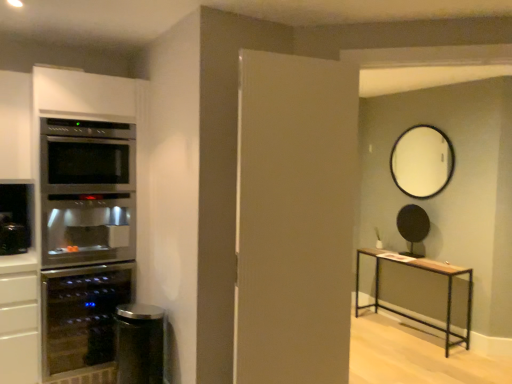
Describe the element at coordinates (426, 270) in the screenshot. This screenshot has width=512, height=384. I see `light brown wood table at right` at that location.

Identify the location of light brown wood table at right. This screenshot has height=384, width=512. (426, 270).

Locate an element on the screen. The image size is (512, 384). satin black trash can at lower left, arranged as the 2th appliance when viewed from the left is located at coordinates [139, 344].

The height and width of the screenshot is (384, 512). Identify the location of stainless steel fridge at left. (85, 238).

The image size is (512, 384). What do you see at coordinates (422, 161) in the screenshot?
I see `white glossy mirror at upper center` at bounding box center [422, 161].

Find the location of a particular element. matte glass wine cooler at left, the second appliance from the front is located at coordinates (82, 316).

At what (x,y) coordinates should I click in order to perform the action: click on light brown wood table at right. Please return your answer as a coordinate pair (x, y). This screenshot has width=512, height=384. Looking at the image, I should click on (426, 270).

Is black matte round mirror at upper center, which appears as the third appliance when viewed from the left, positioned behind white glossy mirror at upper center?

Yes, it is.

Which is more to the right, black matte round mirror at upper center, placed as the first appliance when sorted from right to left, or white glossy mirror at upper center?

From the viewer's perspective, white glossy mirror at upper center appears more on the right side.

Is black matte round mirror at upper center, placed as the first appliance when sorted from right to left, situated inside white glossy mirror at upper center or outside?

The correct answer is: outside.

I want to click on appliance that is the 1st object to the left of the white glossy mirror at upper center, starting at the anchor, so pos(413,227).

Which object is thinner, matte glass wine cooler at left, acting as the 2th appliance starting from the back, or black matte round mirror at upper center, which is the 1th appliance in back-to-front order?

With smaller width is black matte round mirror at upper center, which is the 1th appliance in back-to-front order.

Is matte glass wine cooler at left, acting as the 2th appliance starting from the back, turned away from black matte round mirror at upper center, acting as the 3th appliance starting from the front?

matte glass wine cooler at left, acting as the 2th appliance starting from the back, is not turned away from black matte round mirror at upper center, acting as the 3th appliance starting from the front.

You are a GUI agent. You are given a task and a screenshot of the screen. Output one action in this format:
    pyautogui.click(x=<x>, y=<y>)
    Task: Click on the appliance behind the matte glass wine cooler at left, the second appliance from the front
    The height and width of the screenshot is (384, 512).
    Given the screenshot: What is the action you would take?
    pyautogui.click(x=413, y=227)

Looking at this image, is matte glass wine cooler at left, acting as the 2th appliance starting from the back, in front of or behind black matte round mirror at upper center, placed as the first appliance when sorted from right to left, in the image?

matte glass wine cooler at left, acting as the 2th appliance starting from the back, is positioned closer to the viewer than black matte round mirror at upper center, placed as the first appliance when sorted from right to left.

Which object is positioned more to the right, black matte round mirror at upper center, placed as the first appliance when sorted from right to left, or stainless steel fridge at left?

Positioned to the right is black matte round mirror at upper center, placed as the first appliance when sorted from right to left.

Who is more distant, black matte round mirror at upper center, which appears as the third appliance when viewed from the left, or stainless steel fridge at left?

Positioned behind is black matte round mirror at upper center, which appears as the third appliance when viewed from the left.

Which of these two, black matte round mirror at upper center, which is the 1th appliance in back-to-front order, or stainless steel fridge at left, is wider?

stainless steel fridge at left.

Is black matte round mirror at upper center, which is the 1th appliance in back-to-front order, at the back of white matte door at center?

No, white matte door at center is not facing the opposite direction of black matte round mirror at upper center, which is the 1th appliance in back-to-front order.

Does point (284, 183) appear closer or farther from the camera than point (401, 228)?

Clearly, point (284, 183) is closer to the camera than point (401, 228).

Are white matte door at center and black matte round mirror at upper center, placed as the first appliance when sorted from right to left, located far from each other?

white matte door at center is far away from black matte round mirror at upper center, placed as the first appliance when sorted from right to left.

How many degrees apart are the facing directions of matte glass wine cooler at left, acting as the 2th appliance starting from the back, and stainless steel fridge at left?

The angle between the facing direction of matte glass wine cooler at left, acting as the 2th appliance starting from the back, and the facing direction of stainless steel fridge at left is 0.000774 degrees.

In the scene shown: Can you confirm if matte glass wine cooler at left, the second appliance from the front, is thinner than stainless steel fridge at left?

Yes, matte glass wine cooler at left, the second appliance from the front, is thinner than stainless steel fridge at left.

Is matte glass wine cooler at left, which is the 1th appliance in left-to-right order, oriented away from stainless steel fridge at left?

Correct, matte glass wine cooler at left, which is the 1th appliance in left-to-right order, is looking away from stainless steel fridge at left.

Is point (286, 68) positioned after point (426, 157)?

No.

Is white matte door at center turned away from white glossy mirror at upper center?

white matte door at center does not have its back to white glossy mirror at upper center.

What's the angular difference between white matte door at center and white glossy mirror at upper center's facing directions?

There is a 79.4-degree angle between the facing directions of white matte door at center and white glossy mirror at upper center.

Looking at the image, does white matte door at center seem bigger or smaller compared to white glossy mirror at upper center?

In the image, white matte door at center appears to be larger than white glossy mirror at upper center.

Is light brown wood table at right positioned with its back to white matte door at center?

No, light brown wood table at right is not facing the opposite direction of white matte door at center.

Locate an element on the screen. The width and height of the screenshot is (512, 384). door that appears on the left of light brown wood table at right is located at coordinates (294, 218).

Measure the distance from light brown wood table at right to white matte door at center.

light brown wood table at right and white matte door at center are 1.92 meters apart.

From the image's perspective, which appliance is the 1st one below the white glossy mirror at upper center? Please provide its 2D coordinates.

[(413, 227)]

I want to click on appliance behind the matte glass wine cooler at left, which is the 1th appliance in left-to-right order, so [413, 227].

Looking at the image, which one is located closer to white matte door at center, matte glass wine cooler at left, which is the 1th appliance in left-to-right order, or black matte round mirror at upper center, which appears as the third appliance when viewed from the left?

A: matte glass wine cooler at left, which is the 1th appliance in left-to-right order, is positioned closer to the anchor white matte door at center.

Which object lies nearer to the anchor point white matte door at center, white glossy mirror at upper center or black matte round mirror at upper center, acting as the 3th appliance starting from the front?

white glossy mirror at upper center is positioned closer to the anchor white matte door at center.

Looking at the image, which one is located further to light brown wood table at right, white matte door at center or stainless steel fridge at left?

Based on the image, stainless steel fridge at left appears to be further to light brown wood table at right.

When comparing their distances from black matte round mirror at upper center, which is the 1th appliance in back-to-front order, does stainless steel fridge at left or light brown wood table at right seem closer?

The object closer to black matte round mirror at upper center, which is the 1th appliance in back-to-front order, is light brown wood table at right.

When comparing their distances from satin black trash can at lower left, positioned as the 2th appliance in right-to-left order, does white matte door at center or stainless steel fridge at left seem closer?

stainless steel fridge at left lies closer to satin black trash can at lower left, positioned as the 2th appliance in right-to-left order, than the other object.

Looking at the image, which one is located further to light brown wood table at right, black matte round mirror at upper center, placed as the first appliance when sorted from right to left, or satin black trash can at lower left, which appears as the first appliance when viewed from the front?

The object further to light brown wood table at right is satin black trash can at lower left, which appears as the first appliance when viewed from the front.

Based on the photo, which object lies further to the anchor point white glossy mirror at upper center, light brown wood table at right or satin black trash can at lower left, the third appliance in the back-to-front sequence?

satin black trash can at lower left, the third appliance in the back-to-front sequence, is positioned further to the anchor white glossy mirror at upper center.

Estimate the real-world distances between objects in this image. Which object is further from white glossy mirror at upper center, stainless steel fridge at left or satin black trash can at lower left, arranged as the 2th appliance when viewed from the left?

stainless steel fridge at left lies further to white glossy mirror at upper center than the other object.

Image resolution: width=512 pixels, height=384 pixels. Identify the location of table located between stainless steel fridge at left and white glossy mirror at upper center in the left-right direction. (426, 270).

The image size is (512, 384). I want to click on fridge located between matte glass wine cooler at left, which is the 1th appliance in left-to-right order, and light brown wood table at right in the left-right direction, so click(x=85, y=238).

This screenshot has width=512, height=384. I want to click on door located between satin black trash can at lower left, which appears as the first appliance when viewed from the front, and white glossy mirror at upper center in the left-right direction, so click(294, 218).

Identify the location of fridge between matte glass wine cooler at left, the second appliance from the front, and white glossy mirror at upper center. (85, 238).